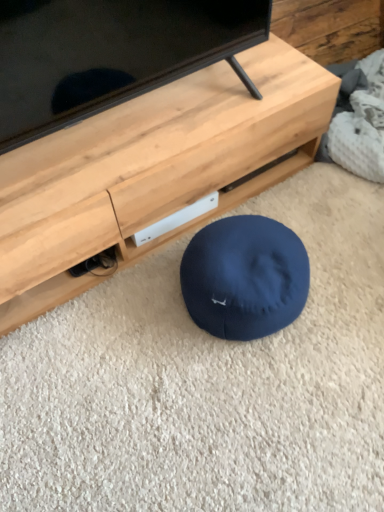
Question: From a real-world perspective, does matte black tv at center stand above matte wood tv stand at center?

Choices:
 (A) no
 (B) yes

Answer: (B)

Question: From the image's perspective, is matte black tv at center on matte wood tv stand at center?

Choices:
 (A) no
 (B) yes

Answer: (B)

Question: From the image's perspective, would you say matte black tv at center is shown under matte wood tv stand at center?

Choices:
 (A) no
 (B) yes

Answer: (A)

Question: Can you confirm if matte black tv at center is positioned to the left of matte wood tv stand at center?

Choices:
 (A) no
 (B) yes

Answer: (B)

Question: Does matte black tv at center have a lesser width compared to matte wood tv stand at center?

Choices:
 (A) yes
 (B) no

Answer: (A)

Question: Would you say matte black tv at center contains matte wood tv stand at center?

Choices:
 (A) yes
 (B) no

Answer: (B)

Question: From the image's perspective, would you say matte wood tv stand at center is shown under matte black tv at center?

Choices:
 (A) yes
 (B) no

Answer: (A)

Question: Is matte wood tv stand at center shorter than matte black tv at center?

Choices:
 (A) yes
 (B) no

Answer: (A)

Question: From a real-world perspective, is matte wood tv stand at center located higher than matte black tv at center?

Choices:
 (A) yes
 (B) no

Answer: (B)

Question: Is matte wood tv stand at center wider than matte black tv at center?

Choices:
 (A) no
 (B) yes

Answer: (B)

Question: Is matte wood tv stand at center smaller than matte black tv at center?

Choices:
 (A) no
 (B) yes

Answer: (A)

Question: Is matte wood tv stand at center not inside matte black tv at center?

Choices:
 (A) yes
 (B) no

Answer: (A)

Question: From a real-world perspective, is matte wood tv stand at center above or below matte black tv at center?

Choices:
 (A) below
 (B) above

Answer: (A)